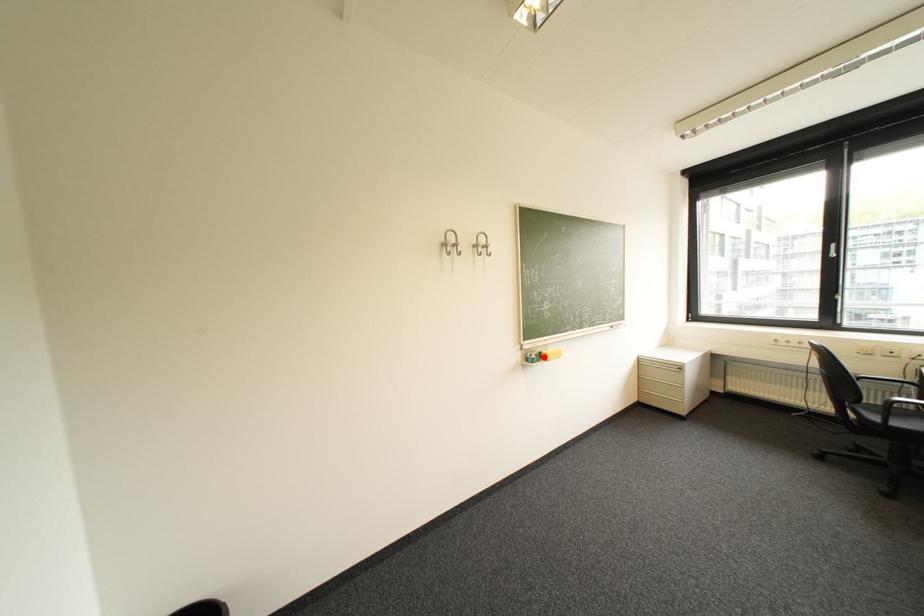
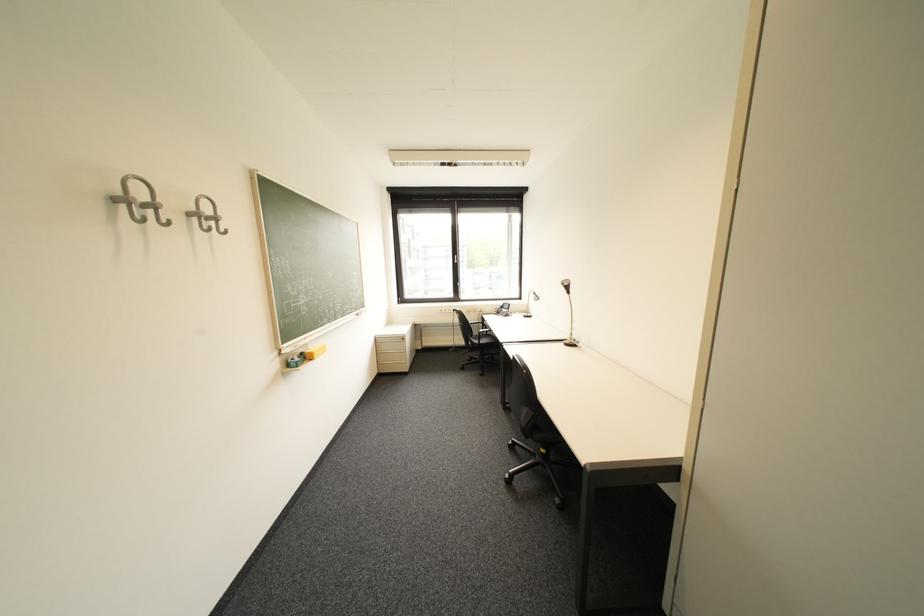
Where in the second image is the point corresponding to the highlighted location from the first image?

(308, 360)